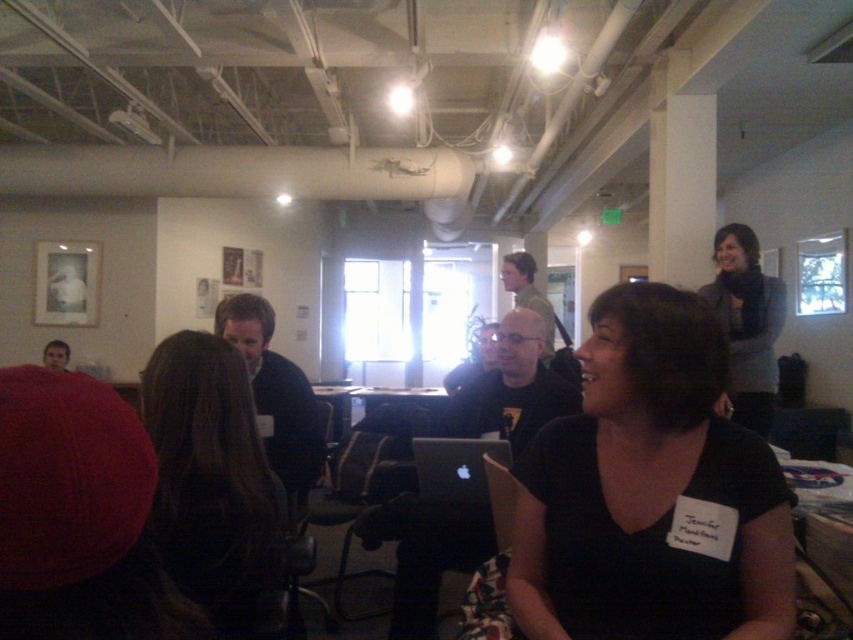
In the scene shown: How far apart are black matte shirt at center and gray wool sweater at upper right?

black matte shirt at center is 2.26 meters away from gray wool sweater at upper right.

Does point (598, 621) come in front of point (775, 337)?

Yes, it is in front of point (775, 337).

Who is more forward, (604, 568) or (746, 365)?

Point (604, 568)

This screenshot has height=640, width=853. Find the location of `black matte shirt at center`. black matte shirt at center is located at coordinates (651, 492).

Is point (781, 561) farther from viewer compared to point (222, 497)?

No, (781, 561) is closer to viewer.

Between black matte shirt at center and dark brown hair at center, which one has more height?

Standing taller between the two is black matte shirt at center.

Find the location of a particular element. black matte shirt at center is located at coordinates (651, 492).

You are a GUI agent. You are given a task and a screenshot of the screen. Output one action in this format:
    pyautogui.click(x=<x>, y=<y>)
    Task: Click on the black matte shirt at center
    The width and height of the screenshot is (853, 640).
    Given the screenshot: What is the action you would take?
    pyautogui.click(x=651, y=492)

Does black matte shirt at center appear on the right side of black matte laptop at center?

Yes, black matte shirt at center is to the right of black matte laptop at center.

Is point (593, 509) closer to viewer compared to point (442, 468)?

Yes, point (593, 509) is closer to viewer.

In order to click on black matte shirt at center in this screenshot , I will do `click(651, 492)`.